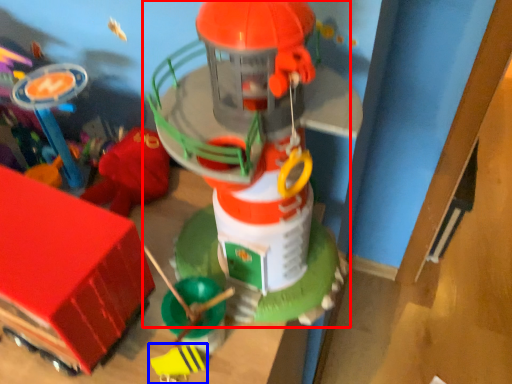
Question: Which object is closer to the camera taking this photo, toy (highlighted by a red box) or toy (highlighted by a blue box)?

Choices:
 (A) toy
 (B) toy

Answer: (A)